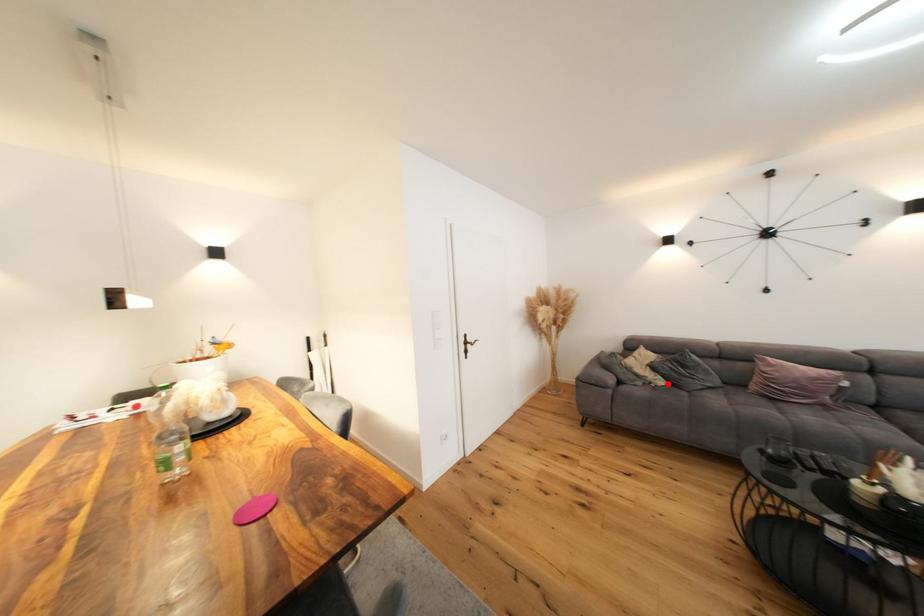
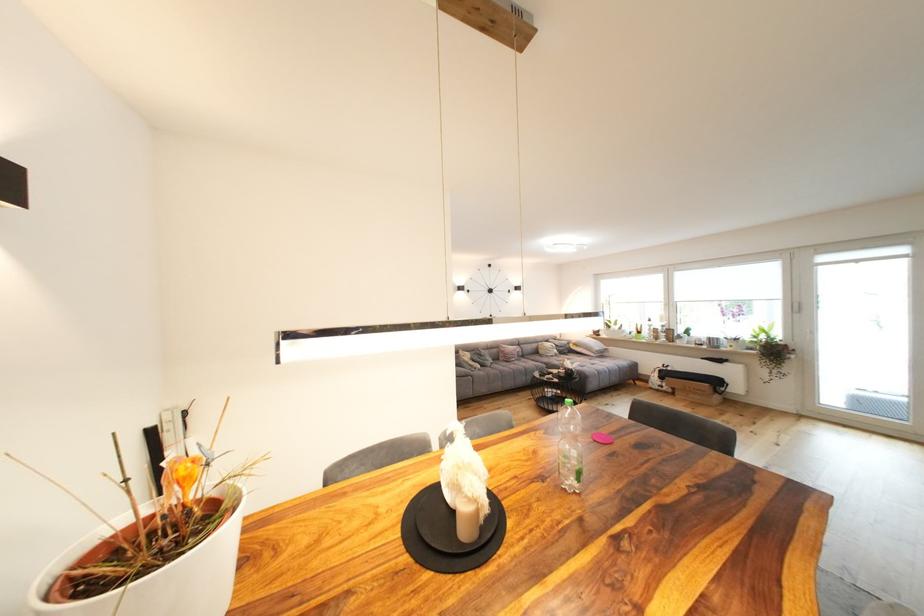
Find the pixel in the second image that matches the highlighted location in the first image.

(485, 368)